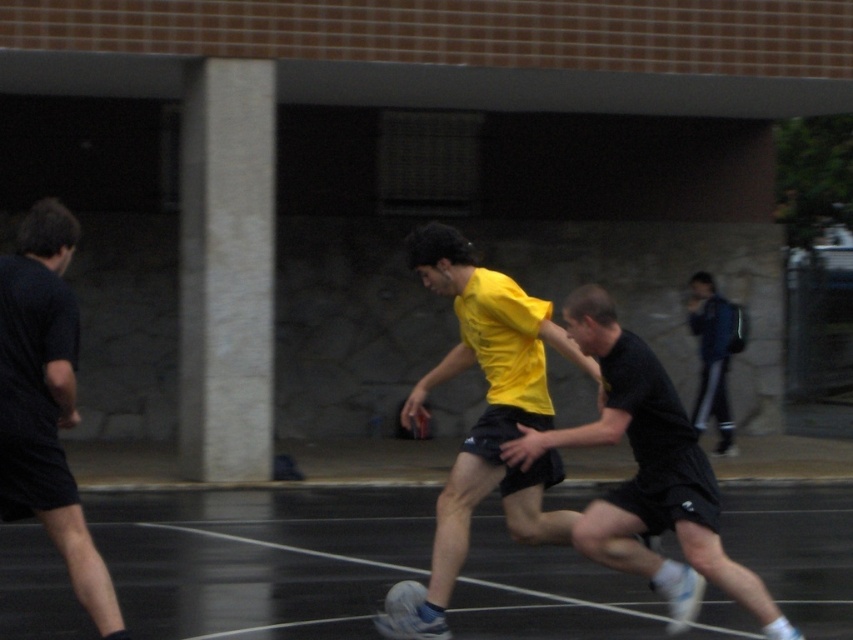
Consider the image. Does black matte shorts at left have a lesser height compared to blue denim jacket at upper right?

Yes.

Is point (27, 356) in front of point (718, 305)?

Yes, it is.

The height and width of the screenshot is (640, 853). In order to click on black matte shorts at left in this screenshot , I will do `click(45, 401)`.

Who is more distant from viewer, (405, 630) or (22, 275)?

Point (405, 630)

At what (x,y) coordinates should I click in order to perform the action: click on yellow matte shirt at center. Please return your answer as a coordinate pair (x, y). Looking at the image, I should click on (485, 412).

Is point (512, 513) positioned in front of point (612, 403)?

No, it is not.

Is yellow matte shirt at center below black textured shorts at center?

Actually, yellow matte shirt at center is above black textured shorts at center.

Where is `yellow matte shirt at center`? yellow matte shirt at center is located at coordinates (485, 412).

Image resolution: width=853 pixels, height=640 pixels. I want to click on yellow matte shirt at center, so click(485, 412).